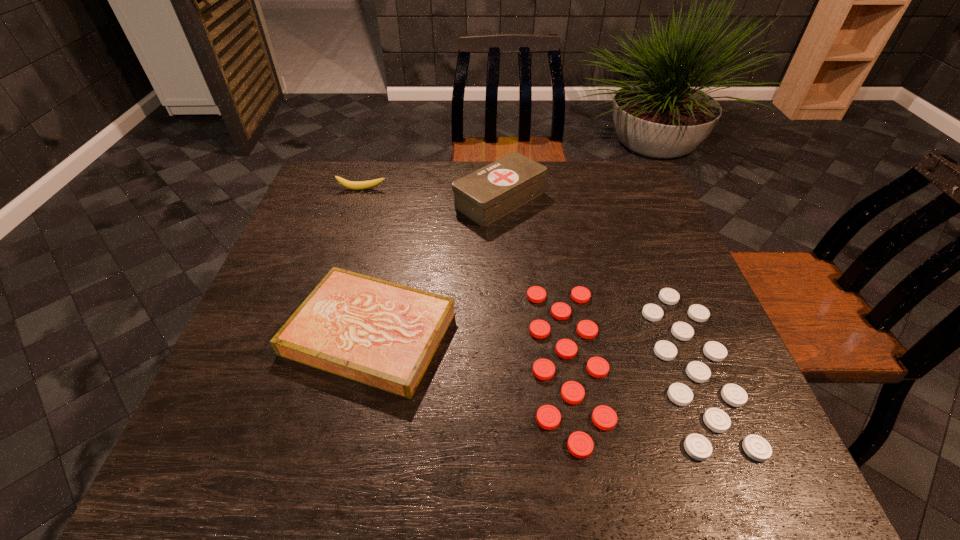
Locate an element on the screen. The image size is (960, 540). free space that satisfies the following two spatial constraints: 1. on the upward curve of the hardback book; 2. on the right side of the banana is located at coordinates (314, 333).